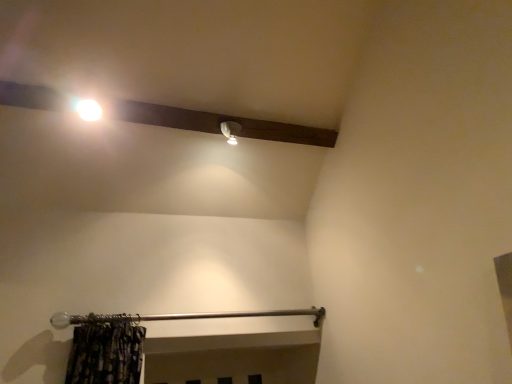
Question: Should I look upward or downward to see silver/metallic curtain rod at lower center?

Choices:
 (A) up
 (B) down

Answer: (B)

Question: Is white glossy light bulb at upper left positioned with its back to silver/metallic curtain rod at lower center?

Choices:
 (A) no
 (B) yes

Answer: (A)

Question: From a real-world perspective, is white glossy light bulb at upper left physically below silver/metallic curtain rod at lower center?

Choices:
 (A) no
 (B) yes

Answer: (A)

Question: Can you confirm if white glossy light bulb at upper left is taller than silver/metallic curtain rod at lower center?

Choices:
 (A) no
 (B) yes

Answer: (A)

Question: Can you confirm if white glossy light bulb at upper left is wider than silver/metallic curtain rod at lower center?

Choices:
 (A) no
 (B) yes

Answer: (A)

Question: Is white glossy light bulb at upper left positioned before silver/metallic curtain rod at lower center?

Choices:
 (A) yes
 (B) no

Answer: (B)

Question: Considering the relative positions of white glossy light bulb at upper left and silver/metallic curtain rod at lower center in the image provided, is white glossy light bulb at upper left behind silver/metallic curtain rod at lower center?

Choices:
 (A) no
 (B) yes

Answer: (B)

Question: Could you tell me if silver/metallic curtain rod at lower center is turned towards white glossy light bulb at upper left?

Choices:
 (A) no
 (B) yes

Answer: (A)

Question: From the image's perspective, is silver/metallic curtain rod at lower center on white glossy light bulb at upper left?

Choices:
 (A) yes
 (B) no

Answer: (B)

Question: Does silver/metallic curtain rod at lower center come behind white glossy light bulb at upper left?

Choices:
 (A) yes
 (B) no

Answer: (B)

Question: Is silver/metallic curtain rod at lower center closer to the viewer compared to white glossy light bulb at upper left?

Choices:
 (A) no
 (B) yes

Answer: (B)

Question: Is silver/metallic curtain rod at lower center taller than white glossy light bulb at upper left?

Choices:
 (A) yes
 (B) no

Answer: (A)

Question: From the image's perspective, is silver/metallic curtain rod at lower center located beneath white glossy light bulb at upper left?

Choices:
 (A) no
 (B) yes

Answer: (B)

Question: Is silver/metallic curtain rod at lower center wider or thinner than white glossy light bulb at upper left?

Choices:
 (A) wide
 (B) thin

Answer: (A)